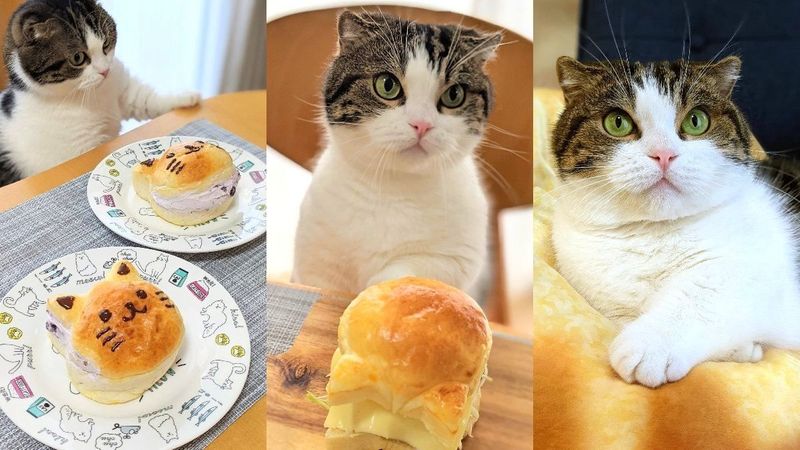
This screenshot has width=800, height=450. In order to click on table in this screenshot , I will do `click(241, 110)`, `click(297, 398)`.